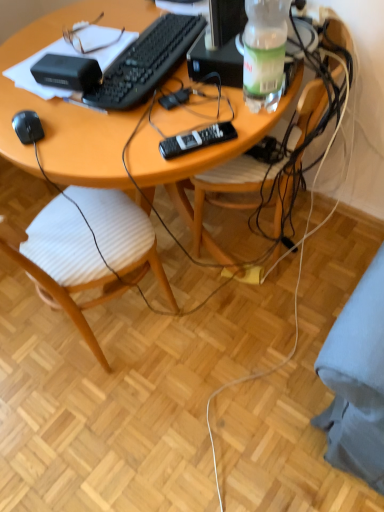
The width and height of the screenshot is (384, 512). Identify the location of empty space that is in between black matte computer mouse at lower left and clear plastic bottle at upper right. (146, 118).